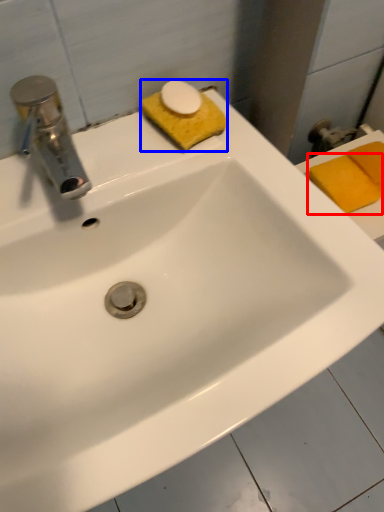
Question: Which object appears closest to the camera in this image, soap (highlighted by a red box) or soap (highlighted by a blue box)?

Choices:
 (A) soap
 (B) soap

Answer: (B)